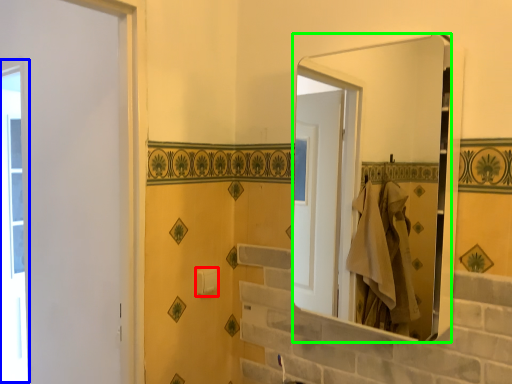
Question: Which object is the farthest from towel bar (highlighted by a red box)? Choose among these: window (highlighted by a blue box) or mirror (highlighted by a green box).

Choices:
 (A) window
 (B) mirror

Answer: (A)